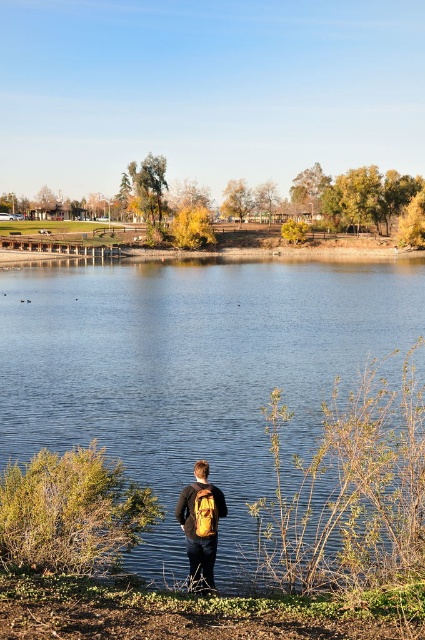
From the picture: Who is lower down, blue smooth water at center or matte yellow backpack at center?

matte yellow backpack at center is below.

Is blue smooth water at center smaller than matte yellow backpack at center?

Actually, blue smooth water at center might be larger than matte yellow backpack at center.

Where is `blue smooth water at center`? This screenshot has height=640, width=425. blue smooth water at center is located at coordinates (189, 365).

At what (x,y) coordinates should I click in order to perform the action: click on blue smooth water at center. Please return your answer as a coordinate pair (x, y). Looking at the image, I should click on (189, 365).